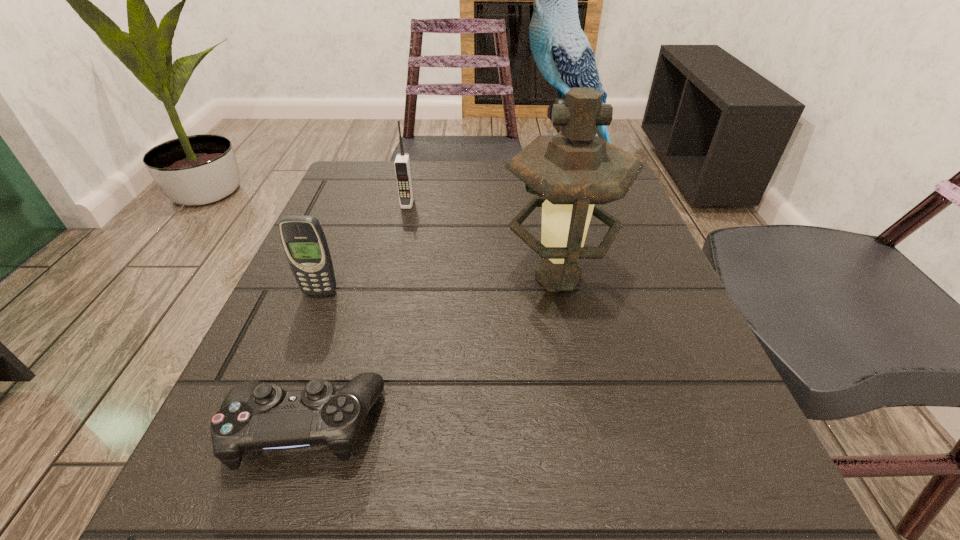
You are a GUI agent. You are given a task and a screenshot of the screen. Output one action in this format:
    pyautogui.click(x=<x>, y=<y>)
    Task: Click on the oil lamp present at the right edge
    Image resolution: width=960 pixels, height=540 pixels.
    Given the screenshot: What is the action you would take?
    pyautogui.click(x=575, y=171)

I want to click on object located in the far left corner section of the desktop, so click(x=402, y=165).

The height and width of the screenshot is (540, 960). Find the location of `object located at the near left corner`. object located at the near left corner is located at coordinates (254, 416).

I want to click on object positioned at the far right corner, so click(561, 50).

The image size is (960, 540). What are the coordinates of `vacant area at the far edge of the desktop` in the screenshot? It's located at (488, 186).

The height and width of the screenshot is (540, 960). Find the location of `free space at the left edge`. free space at the left edge is located at coordinates (338, 243).

The width and height of the screenshot is (960, 540). Find the location of `blank space at the right edge`. blank space at the right edge is located at coordinates (650, 241).

In the image, there is a desktop. Identify the location of vacant space at the far left corner. Image resolution: width=960 pixels, height=540 pixels. (365, 180).

In the image, there is a desktop. Find the location of `vacant space at the near left corner`. vacant space at the near left corner is located at coordinates (300, 536).

Locate an element on the screen. This screenshot has height=540, width=960. free space between the oil lamp and the farther cellular telephone is located at coordinates (483, 241).